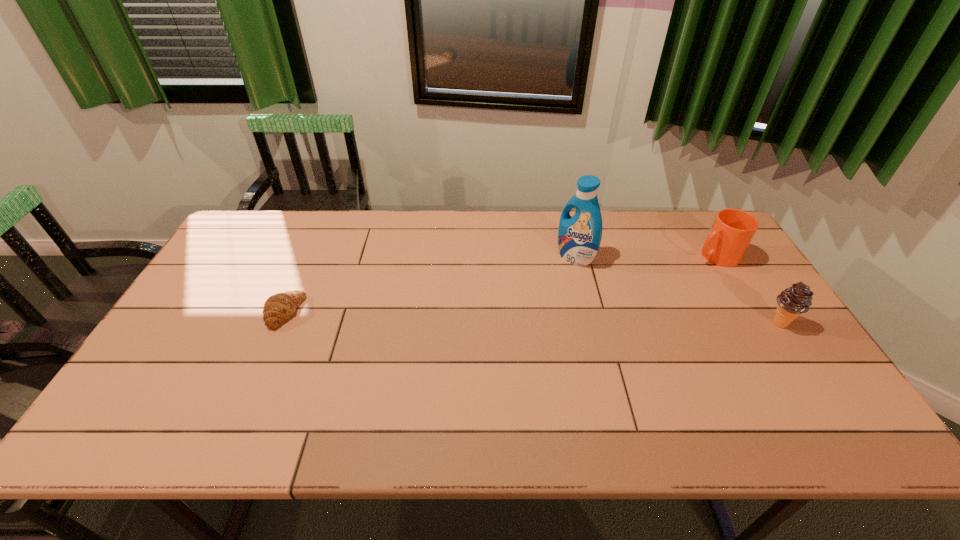
This screenshot has height=540, width=960. I want to click on free area in between the mug and the third object from right to left, so click(x=645, y=256).

At what (x,y) coordinates should I click in order to perform the action: click on free space between the mug and the second object from left to right. Please return your answer as a coordinate pair (x, y). Looking at the image, I should click on (645, 256).

At what (x,y) coordinates should I click in order to perform the action: click on free space between the icecream and the tallest object. Please return your answer as a coordinate pair (x, y). The width and height of the screenshot is (960, 540). Looking at the image, I should click on (677, 290).

Locate an element on the screen. This screenshot has width=960, height=540. vacant area that lies between the icecream and the tallest object is located at coordinates (677, 290).

This screenshot has width=960, height=540. I want to click on free space between the third object from right to left and the mug, so click(645, 256).

This screenshot has height=540, width=960. I want to click on free point between the mug and the third object from right to left, so click(x=645, y=256).

Locate which object is the closest to the crescent roll. Please provide its 2D coordinates. Your answer should be formatted as a tuple, i.e. [(x, y)], where the tuple contains the x and y coordinates of a point satisfying the conditions above.

[(579, 237)]

Identify which object is the second closest to the mug. Please provide its 2D coordinates. Your answer should be formatted as a tuple, i.e. [(x, y)], where the tuple contains the x and y coordinates of a point satisfying the conditions above.

[(579, 237)]

Image resolution: width=960 pixels, height=540 pixels. What are the coordinates of `vacant space that satisfies the following two spatial constraints: 1. on the back side of the crescent roll; 2. on the left side of the detergent` in the screenshot? It's located at (308, 257).

Find the location of a particular element. free space in the image that satisfies the following two spatial constraints: 1. on the front side of the shortest object; 2. on the right side of the icecream is located at coordinates (279, 323).